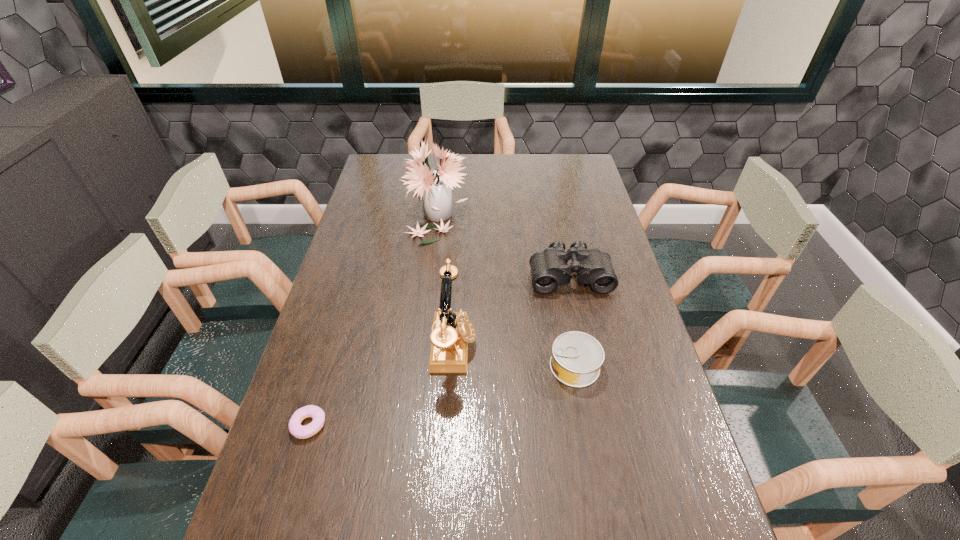
At what (x,y) coordinates should I click in order to perform the action: click on the tallest object. Please return your answer as a coordinate pair (x, y). This screenshot has width=960, height=540. Looking at the image, I should click on (435, 187).

Find the location of `bouquet`. bouquet is located at coordinates (435, 187).

Locate an element on the screen. This screenshot has height=540, width=960. telephone is located at coordinates 451,332.

Locate an element on the screen. Image resolution: width=960 pixels, height=540 pixels. binoculars is located at coordinates (549, 268).

This screenshot has width=960, height=540. What are the coordinates of `the third tallest object` in the screenshot? It's located at (549, 268).

At what (x,y) coordinates should I click in order to perform the action: click on the fourth tallest object. Please return your answer as a coordinate pair (x, y). This screenshot has height=540, width=960. Looking at the image, I should click on (577, 357).

Find the location of `the nearest object`. the nearest object is located at coordinates (296, 429).

This screenshot has width=960, height=540. I want to click on the shortest object, so click(x=296, y=429).

Identify the location of free space located 0.130m on the left of the farthest object. The width and height of the screenshot is (960, 540). (366, 212).

I want to click on vacant space located on the dial of the second tallest object, so click(523, 346).